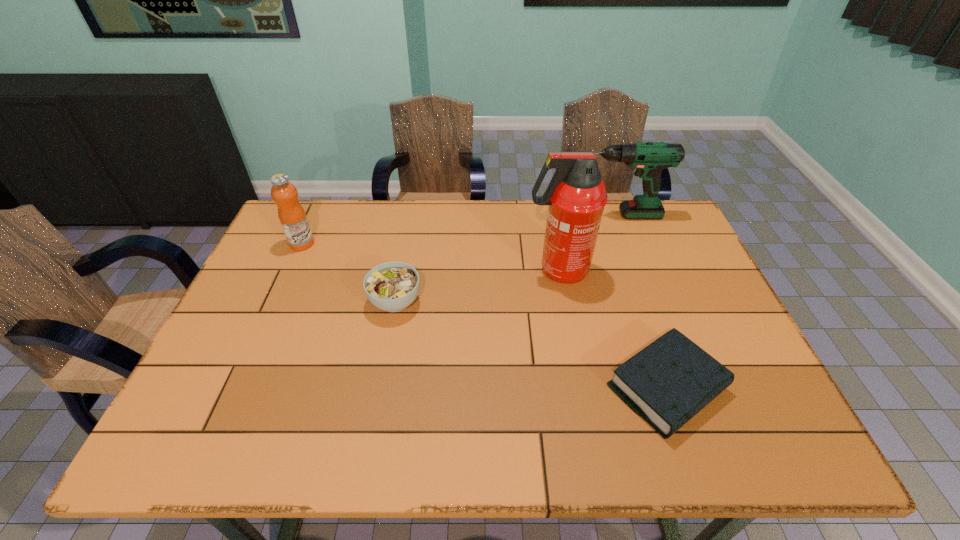
What are the coordinates of `unoccupied position between the second object from left to right and the Bible` in the screenshot? It's located at (531, 345).

This screenshot has width=960, height=540. What are the coordinates of `object that is the second closest to the fire extinguisher` in the screenshot? It's located at (x=667, y=383).

Identify the location of the closest object relative to the tallest object. The height and width of the screenshot is (540, 960). (649, 158).

Find the location of a particular element. free space that satisfies the following two spatial constraints: 1. on the trigger side of the shortest object; 2. on the left side of the fire extinguisher is located at coordinates (579, 388).

The image size is (960, 540). I want to click on free spot that satisfies the following two spatial constraints: 1. on the handle side of the farthest object; 2. on the front side of the nearest object, so click(681, 388).

Where is `vacant position in the image that satisfies the following two spatial constraints: 1. on the trigger side of the fire extinguisher; 2. on the right side of the nearest object`? vacant position in the image that satisfies the following two spatial constraints: 1. on the trigger side of the fire extinguisher; 2. on the right side of the nearest object is located at coordinates (579, 388).